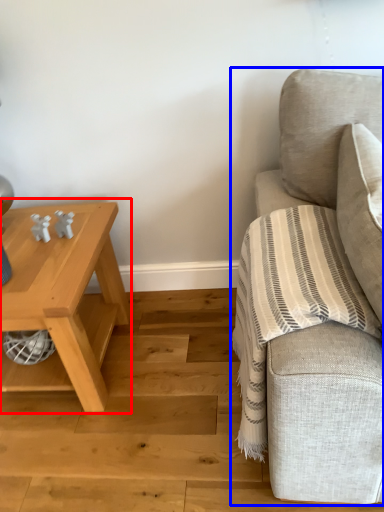
Question: Which of the following is the farthest to the observer, table (highlighted by a red box) or studio couch (highlighted by a blue box)?

Choices:
 (A) table
 (B) studio couch

Answer: (A)